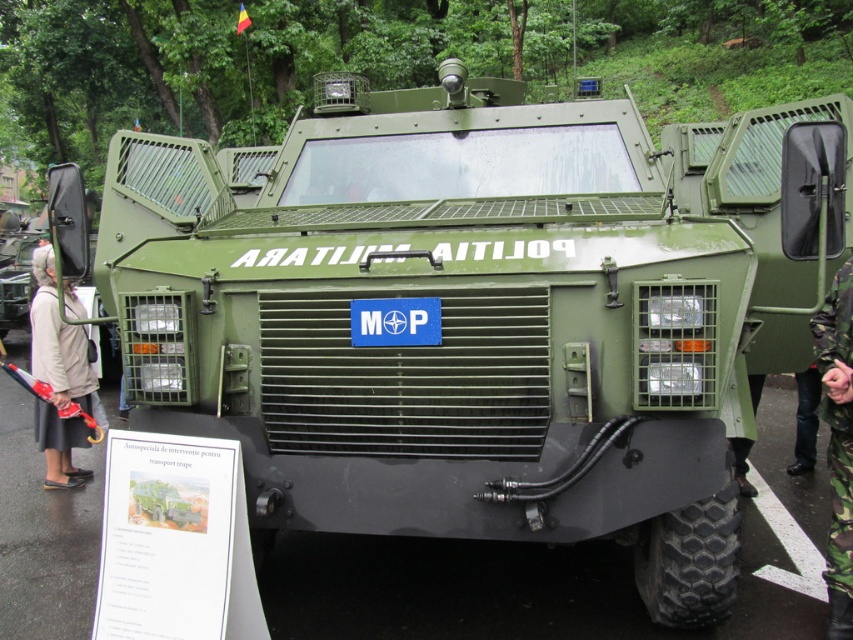
Question: Which point appears farthest from the camera in this image?

Choices:
 (A) (842, 540)
 (B) (82, 310)

Answer: (B)

Question: Is beige fabric coat at left thinner than camouflage fabric uniform at right?

Choices:
 (A) yes
 (B) no

Answer: (B)

Question: Is beige fabric coat at left bigger than camouflage fabric uniform at right?

Choices:
 (A) no
 (B) yes

Answer: (B)

Question: Is beige fabric coat at left closer to the viewer compared to camouflage fabric uniform at right?

Choices:
 (A) no
 (B) yes

Answer: (A)

Question: Which object is farther from the camera taking this photo?

Choices:
 (A) camouflage fabric uniform at right
 (B) beige fabric coat at left

Answer: (B)